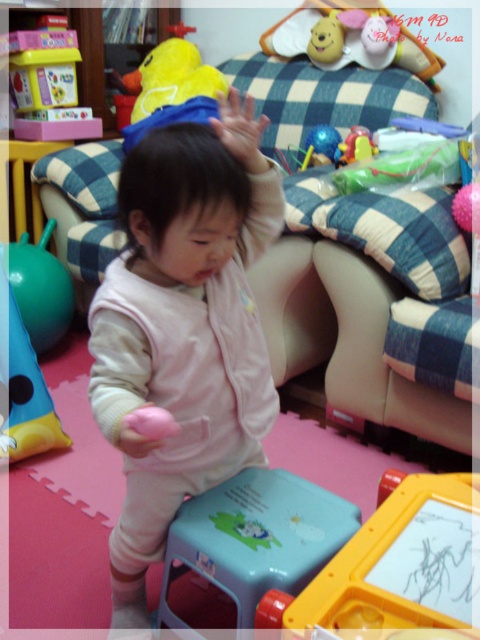
From the picture: Is matte plastic toy at upper left shorter than rubber duck at center?

No.

Is point (24, 92) positioned after point (364, 156)?

That is True.

Where is `matte plastic toy at upper left`? This screenshot has width=480, height=640. matte plastic toy at upper left is located at coordinates (46, 70).

Does point (118, 284) come closer to viewer compared to point (20, 104)?

Yes, it is in front of point (20, 104).

Which is behind, point (170, 308) or point (23, 76)?

The point (23, 76) is behind.

Identify the location of pink fabric baby at center. (x=183, y=326).

Where is `pink fabric baby at center`? pink fabric baby at center is located at coordinates (183, 326).

Measure the distance between pink fabric baby at center and camera.

34.22 inches

Can you confirm if pink fabric baby at center is thinner than rubber duck at center?

In fact, pink fabric baby at center might be wider than rubber duck at center.

Is point (135, 454) positioned before point (348, 145)?

Yes, it is in front of point (348, 145).

Find the location of a particular element. Image resolution: width=480 pixels, height=640 pixels. pink fabric baby at center is located at coordinates (183, 326).